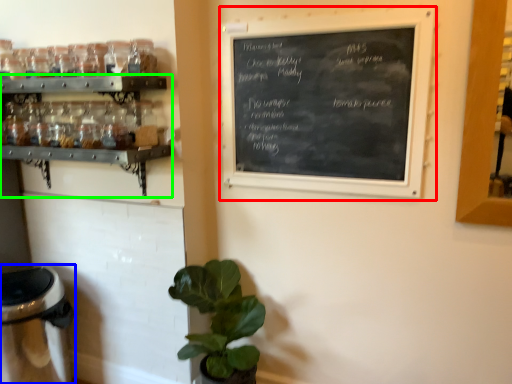
Question: Which object is positioned farthest from bulletin board (highlighted by a red box)? Select from appliance (highlighted by a blue box) and shelf (highlighted by a green box).

Choices:
 (A) appliance
 (B) shelf

Answer: (A)